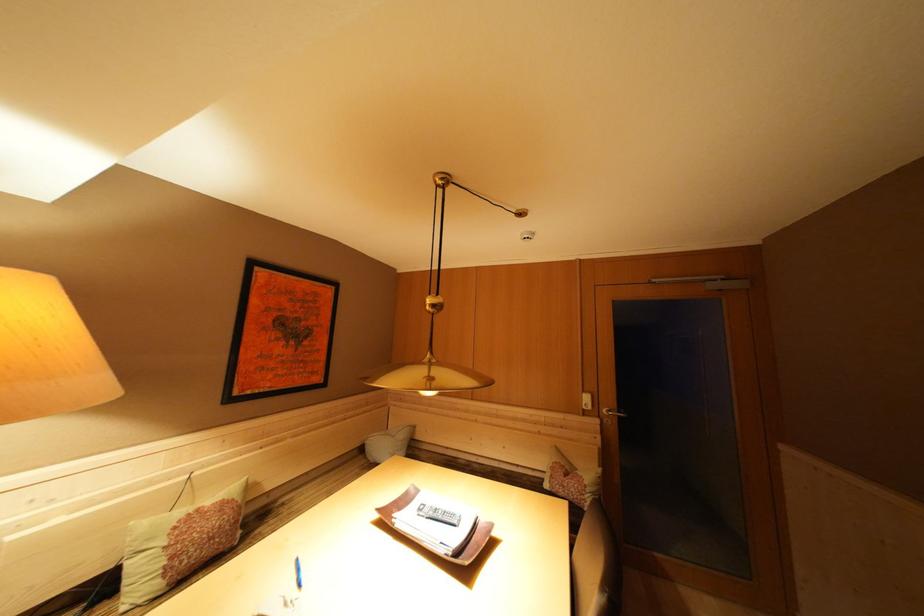
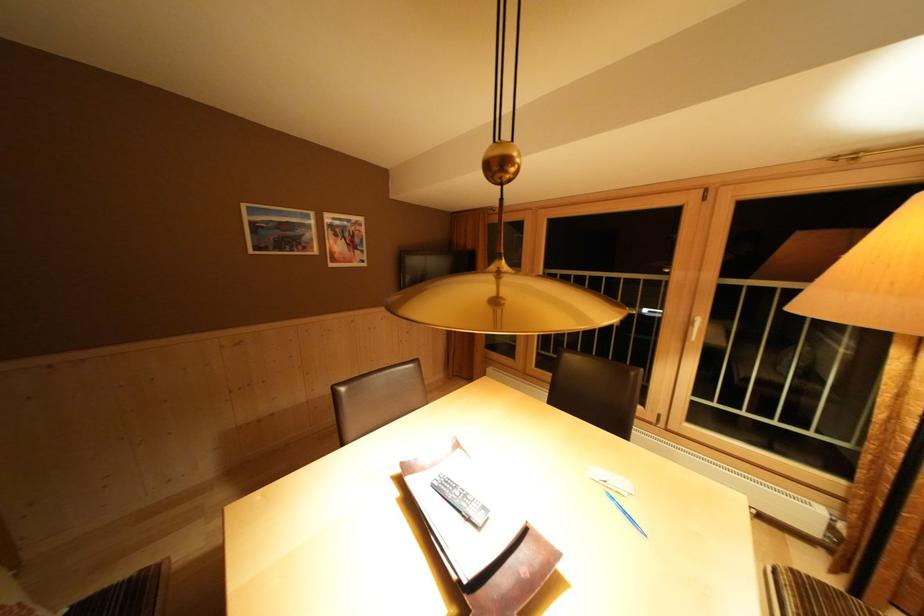
In the second image, find the point that corresponds to point (306, 575) in the first image.

(633, 517)